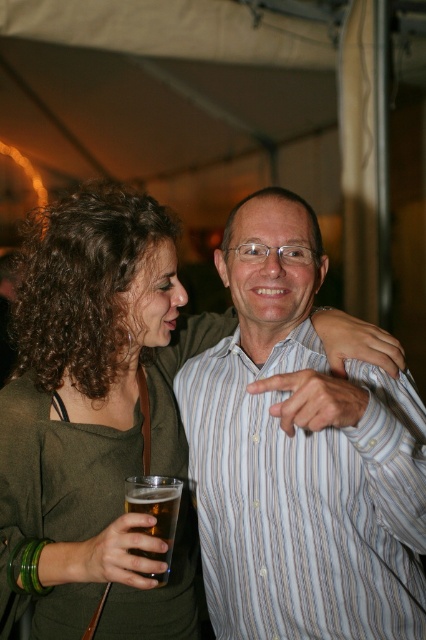
Which is above, striped cotton shirt at center or translucent glass beer at lower left?

Positioned higher is striped cotton shirt at center.

Is striped cotton shirt at center bigger than translucent glass beer at lower left?

Yes, striped cotton shirt at center is bigger than translucent glass beer at lower left.

The height and width of the screenshot is (640, 426). Identify the location of striped cotton shirt at center. (305, 500).